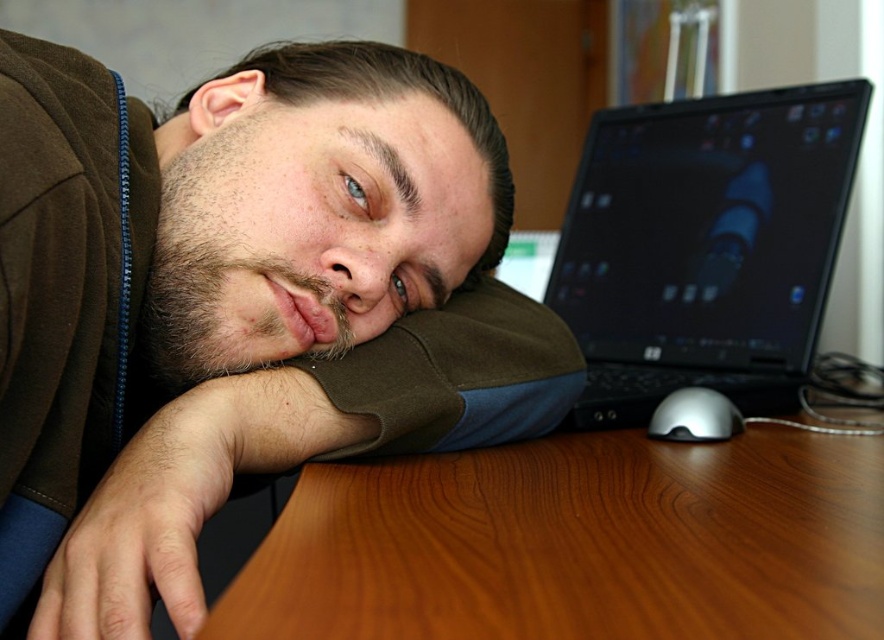
You are a photographer setting up a shot of the scene. You need to focus on one of the two points, either point (404, 230) or point (667, 410). Which point should you focus on to ensure it appears larger in the final photo?

Point (404, 230) is closer to the viewer than point (667, 410), so focusing on point (404, 230) will make it appear larger in the photo.

You are standing in front of the desk and see the point at coordinates (238,305). Which object is this point located on?

The point at coordinates (238,305) is located on the brown suede jacket at center.

You are organizing a desk and need to place the brown suede jacket at center and the silver metallic mouse at lower right. Which object requires more horizontal space on the desk?

The brown suede jacket at center requires more horizontal space because its width surpasses that of the silver metallic mouse at lower right.